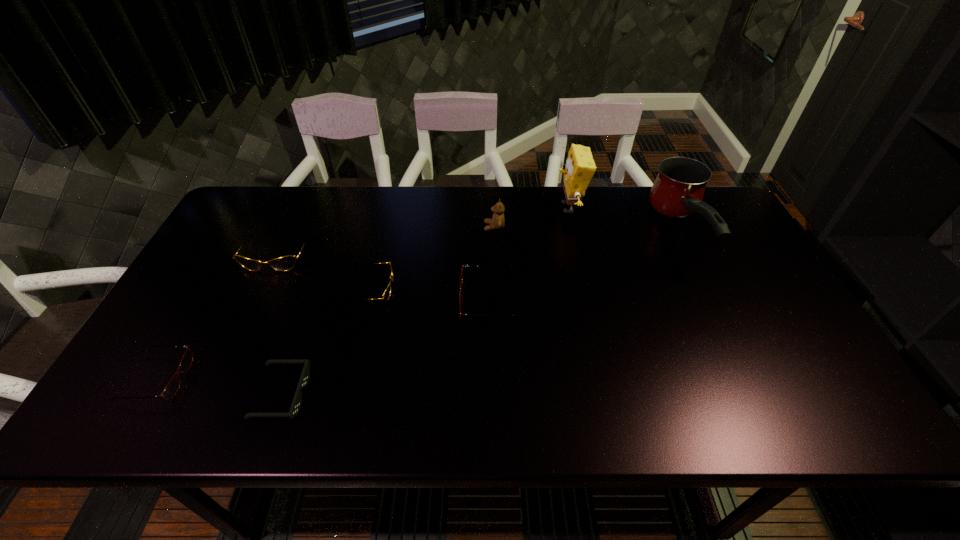
Locate an element on the screen. The image size is (960, 540). sponge is located at coordinates (580, 167).

In order to click on the seventh object from left to right in this screenshot , I will do `click(580, 167)`.

Find the location of `the second tallest object`. the second tallest object is located at coordinates (678, 190).

Locate an element on the screen. saucepan is located at coordinates (678, 190).

The width and height of the screenshot is (960, 540). In order to click on the sixth shortest object in this screenshot , I will do `click(498, 221)`.

You are a GUI agent. You are given a task and a screenshot of the screen. Output one action in this format:
    pyautogui.click(x=<x>, y=<y>)
    Task: Click on the bigger gold spectacles
    
    Given the screenshot: What is the action you would take?
    pyautogui.click(x=284, y=263)

I want to click on the rightmost spectacles, so click(x=461, y=291).

What are the coordinates of `the farther red spectacles` in the screenshot? It's located at (461, 291).

The image size is (960, 540). I want to click on the smaller gold spectacles, so click(387, 292).

You are a GUI agent. You are given a task and a screenshot of the screen. Output one action in this format:
    pyautogui.click(x=<x>, y=<y>)
    Task: Click on the third spectacles from left to right
    This screenshot has width=960, height=540.
    Given the screenshot: What is the action you would take?
    pyautogui.click(x=387, y=292)